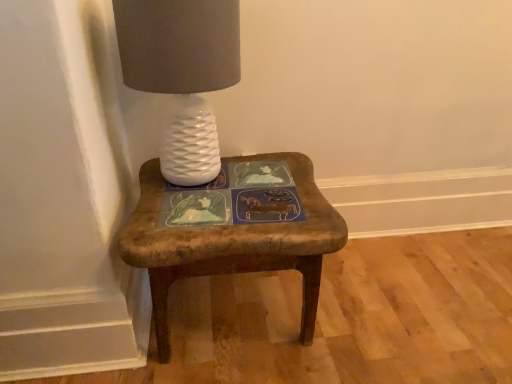
Identify the location of vacant space situated above wooden stool at center (from a real-world perspective). (234, 198).